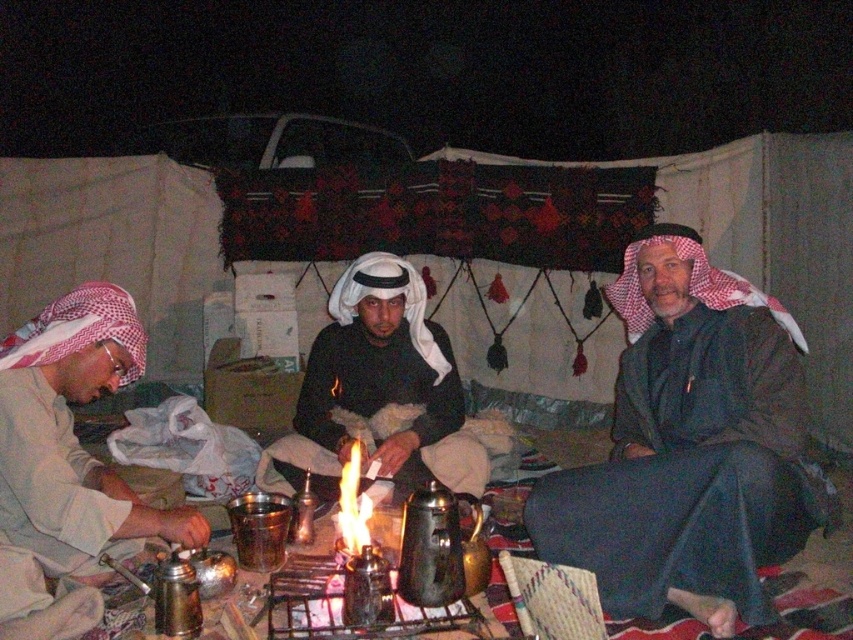
Question: Does dark green fabric at center have a larger size compared to white fabric headscarf at left?

Choices:
 (A) yes
 (B) no

Answer: (A)

Question: Is white fabric headscarf at left wider than white matte cloth at center?

Choices:
 (A) no
 (B) yes

Answer: (A)

Question: Which point appears farthest from the camera in this image?

Choices:
 (A) (704, 512)
 (B) (65, 515)
 (C) (402, 353)

Answer: (C)

Question: Among these objects, which one is nearest to the camera?

Choices:
 (A) dark green fabric at center
 (B) white matte cloth at center
 (C) white fabric headscarf at left

Answer: (C)

Question: Among these objects, which one is nearest to the camera?

Choices:
 (A) dark green fabric at center
 (B) white fabric headscarf at left
 (C) white matte cloth at center

Answer: (B)

Question: Does dark green fabric at center have a greater width compared to white fabric headscarf at left?

Choices:
 (A) yes
 (B) no

Answer: (A)